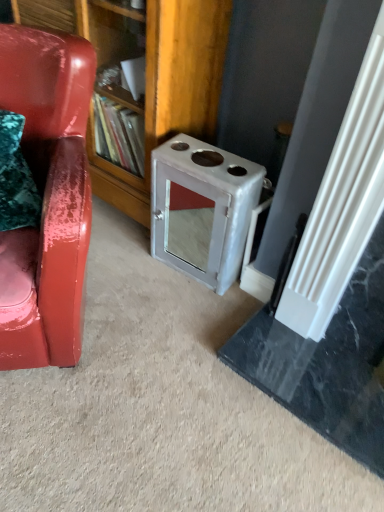
Identify the location of free space in front of metallic gray stove at center-right. The image size is (384, 512). (180, 308).